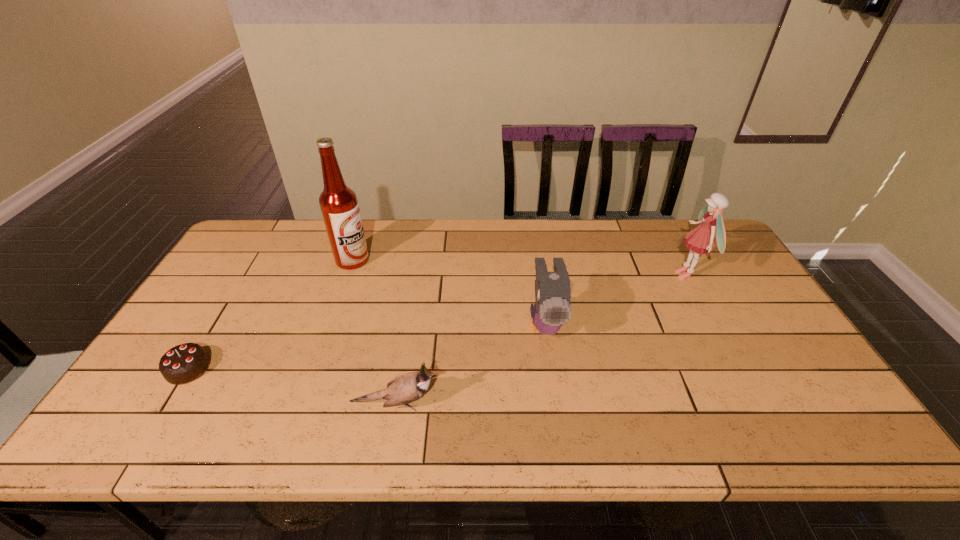
This screenshot has width=960, height=540. Find the location of `free space between the farther bird and the third object from left to right`. free space between the farther bird and the third object from left to right is located at coordinates (470, 364).

Where is `free space between the alcohol and the shorter bird`? free space between the alcohol and the shorter bird is located at coordinates (374, 332).

This screenshot has width=960, height=540. Identify the location of unoccupied position between the nearer bird and the fourth object from right to left. (374, 332).

Locate an element on the screen. Image resolution: width=960 pixels, height=540 pixels. empty space that is in between the fourth shortest object and the nearer bird is located at coordinates (541, 340).

Where is `free space between the nearer bird and the alcohol`? This screenshot has width=960, height=540. free space between the nearer bird and the alcohol is located at coordinates (374, 332).

Find the location of a particular element. The image size is (960, 540). vacant region between the right bird and the second tallest object is located at coordinates (616, 300).

I want to click on empty space between the leftmost object and the tallest object, so click(271, 314).

I want to click on free space between the third tallest object and the nearest object, so click(x=470, y=364).

Where is `unoccupied area between the second object from left to right and the rightmost object`? unoccupied area between the second object from left to right and the rightmost object is located at coordinates (519, 268).

Select which object appears as the fourth closest to the rightmost object. Please provide its 2D coordinates. Your answer should be formatted as a tuple, i.e. [(x, y)], where the tuple contains the x and y coordinates of a point satisfying the conditions above.

[(184, 363)]